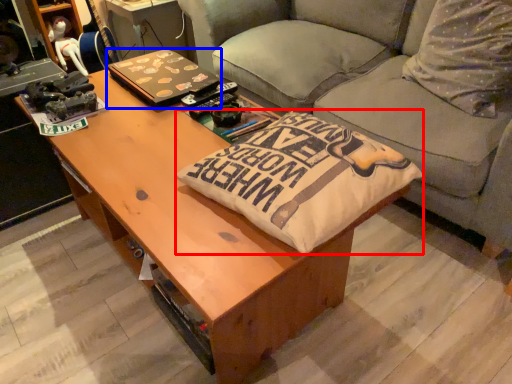
Question: Which of the following is the farthest to the observer, throw pillow (highlighted by a red box) or laptop (highlighted by a blue box)?

Choices:
 (A) throw pillow
 (B) laptop

Answer: (B)